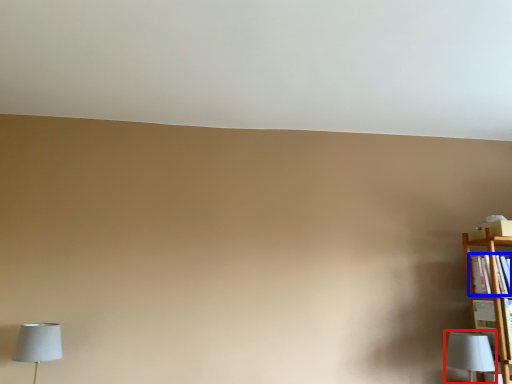
Question: Which of the following is the closest to the observer, lamp (highlighted by a red box) or book (highlighted by a blue box)?

Choices:
 (A) lamp
 (B) book

Answer: (A)